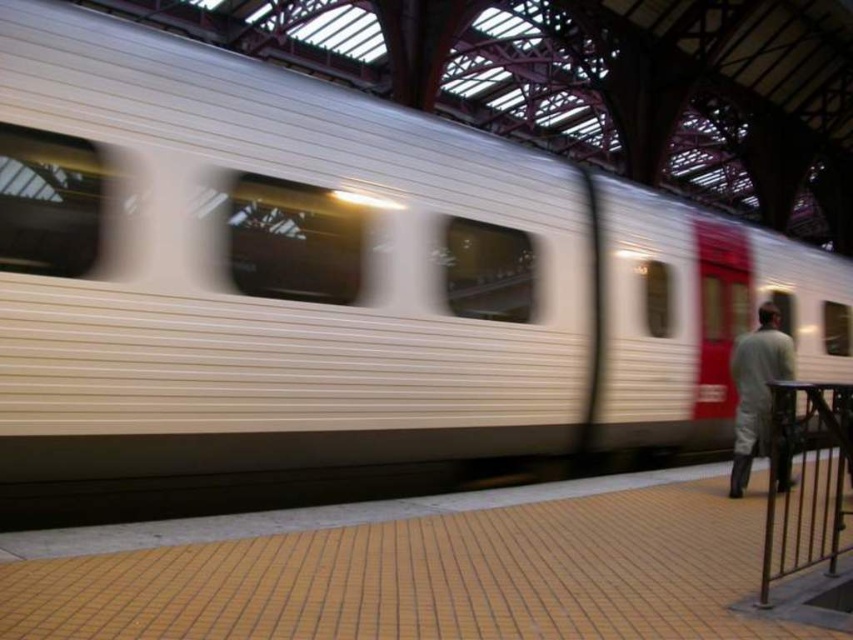
You are standing at the train station and want to reach a specific point marked at coordinates point (804, 556). If your walking speed is 1.5 meters per second, how long will it take you to reach that point?

The distance of point (804, 556) from camera is 4.06 meters. At a walking speed of 1.5 meters per second, it would take approximately 2.71 seconds to reach the point.

You are standing at the entrance of the train station and want to reach the metallic silver rail at lower right. Which direction should you move relative to your current position?

The metallic silver rail at lower right is located at point 0.750 on the x axis and 0.946 on the y axis, so you should move towards the lower right direction to reach it.

You are a photographer standing at the train station. You want to capture a photo of the metallic silver rail at lower right and the gray fabric pants at right. Based on their positions, which object is closer to the camera?

The metallic silver rail at lower right is positioned under the gray fabric pants at right, so the gray fabric pants at right are closer to the camera since the rail is beneath them.